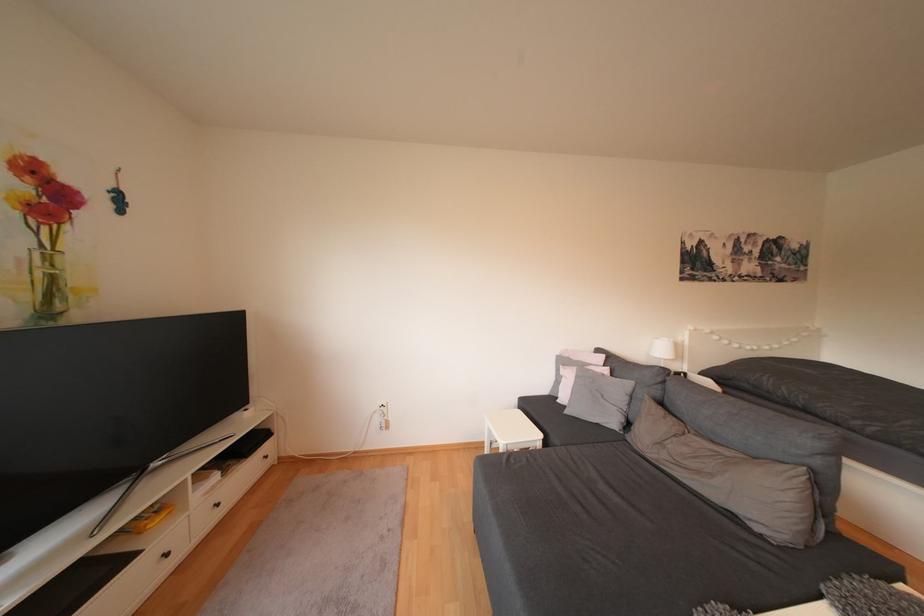
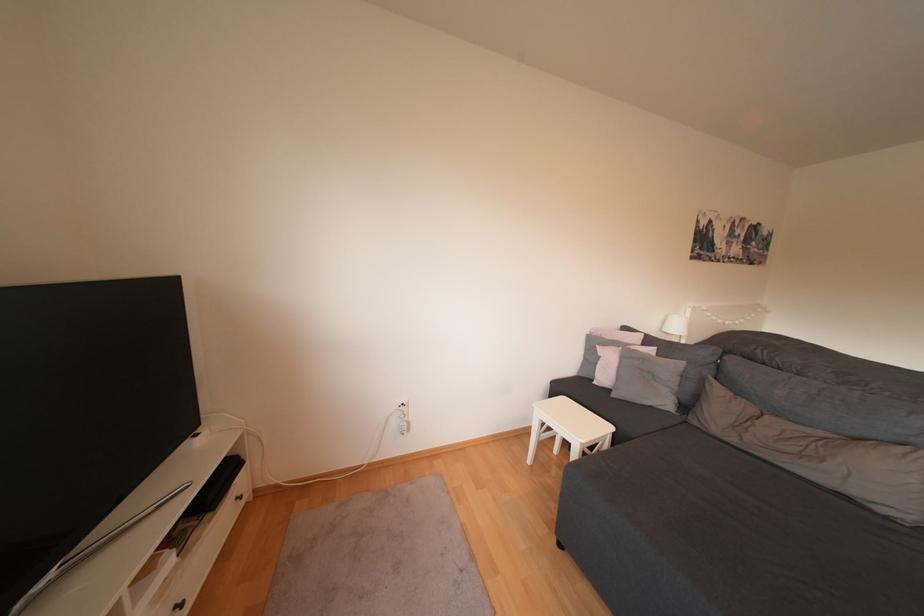
Question: The camera is either moving clockwise (left) or counter-clockwise (right) around the object. The first image is from the beginning of the video and the second image is from the end. Is the camera moving left or right when shooting the video?

Choices:
 (A) Left
 (B) Right

Answer: (A)